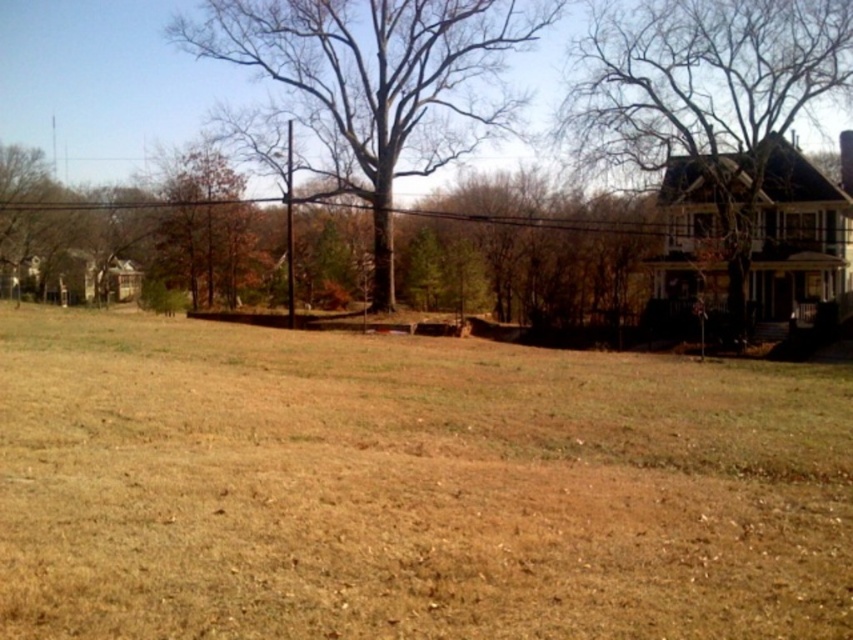
Who is shorter, brown grassy field at center or bare wood tree at center?

Standing shorter between the two is brown grassy field at center.

Measure the distance between brown grassy field at center and camera.

brown grassy field at center and camera are 4.46 meters apart from each other.

The width and height of the screenshot is (853, 640). I want to click on brown grassy field at center, so click(x=409, y=486).

Locate an element on the screen. The image size is (853, 640). brown grassy field at center is located at coordinates (409, 486).

Which of these two, brown wooden fence at upper center or bare branches at upper right, stands taller?

bare branches at upper right is taller.

Is brown wooden fence at upper center further to the viewer compared to bare branches at upper right?

Yes, it is behind bare branches at upper right.

Does point (152, 209) lie behind point (724, 156)?

That is True.

Where is `brown wooden fence at upper center`? The width and height of the screenshot is (853, 640). brown wooden fence at upper center is located at coordinates (573, 260).

Is bare wood tree at center thinner than bare branches at upper right?

No.

Consider the image. Is bare wood tree at center above bare branches at upper right?

Yes, bare wood tree at center is above bare branches at upper right.

Is point (219, 3) less distant than point (734, 268)?

No, it is behind (734, 268).

This screenshot has width=853, height=640. What are the coordinates of `bare wood tree at center` in the screenshot? It's located at [x=378, y=83].